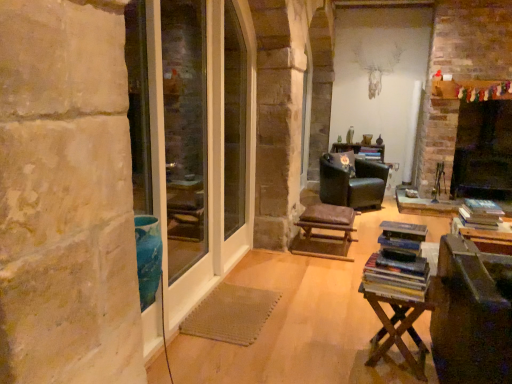
The height and width of the screenshot is (384, 512). I want to click on free area in between clear glass door at left, the second screen door when ordered from right to left, and wooden table at lower right, so click(x=266, y=326).